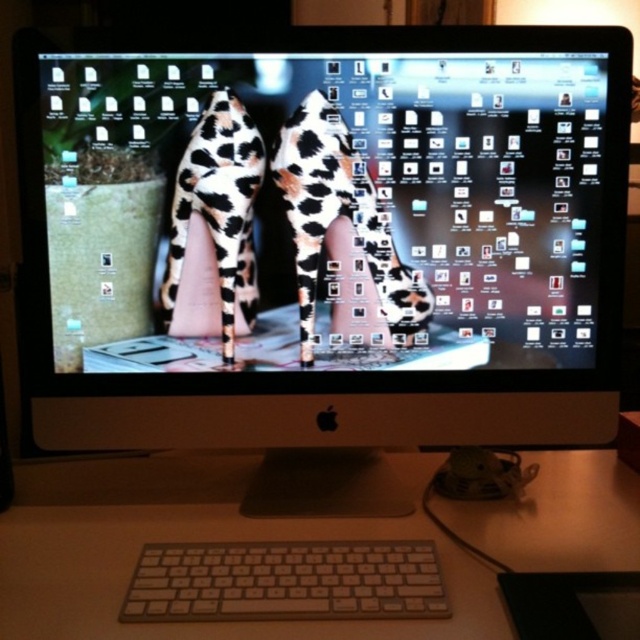
Is white plastic keyboard at center to the left of white plastic keyboard at lower center from the viewer's perspective?

No, white plastic keyboard at center is not to the left of white plastic keyboard at lower center.

Is point (52, 605) positioned behind point (179, 573)?

No.

Locate an element on the screen. The image size is (640, 640). white plastic keyboard at center is located at coordinates (193, 541).

Which is above, matte plastic monitor at center or white plastic keyboard at center?

matte plastic monitor at center is above.

Does matte plastic monitor at center have a greater height compared to white plastic keyboard at center?

Yes.

Describe the element at coordinates (326, 241) in the screenshot. I see `matte plastic monitor at center` at that location.

Locate an element on the screen. This screenshot has height=640, width=640. matte plastic monitor at center is located at coordinates [326, 241].

The width and height of the screenshot is (640, 640). What do you see at coordinates (326, 241) in the screenshot?
I see `matte plastic monitor at center` at bounding box center [326, 241].

Does matte plastic monitor at center have a lesser height compared to cow print fabric shoe at center?

No, matte plastic monitor at center is not shorter than cow print fabric shoe at center.

The image size is (640, 640). In order to click on matte plastic monitor at center in this screenshot , I will do `click(326, 241)`.